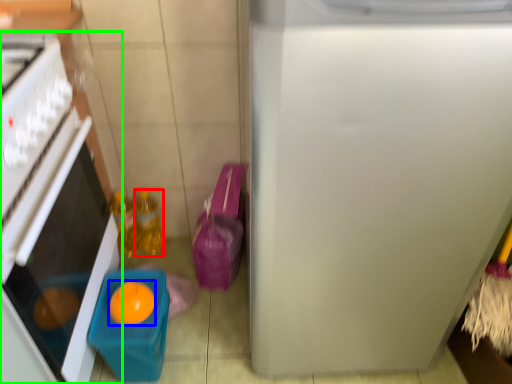
Question: Which is farther away from bottle (highlighted by a red box)? orange (highlighted by a blue box) or home appliance (highlighted by a green box)?

Choices:
 (A) orange
 (B) home appliance

Answer: (B)